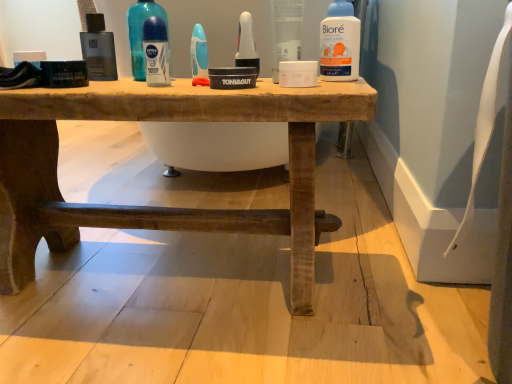
Where is `free space behind rustic wood table at center`? free space behind rustic wood table at center is located at coordinates (201, 189).